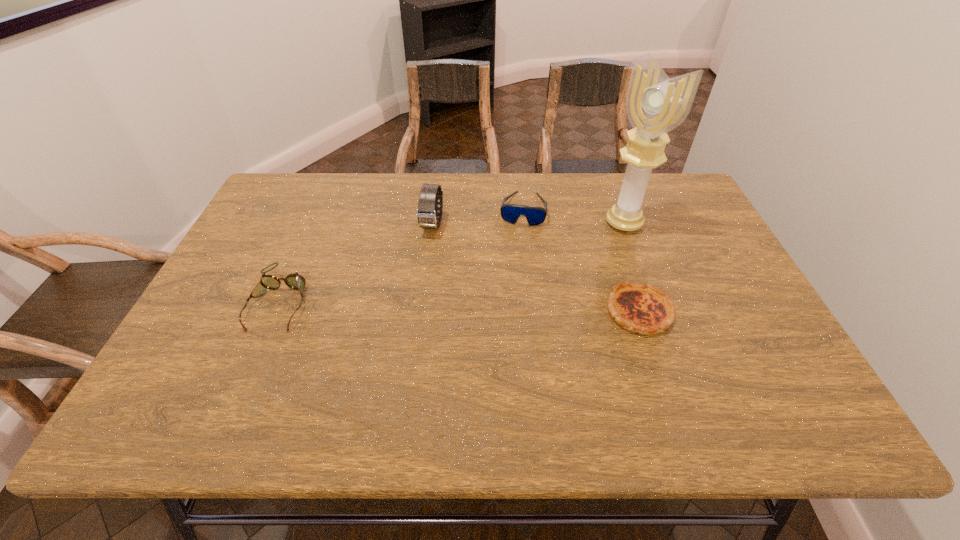
Find the location of a particular element. Image resolution: width=960 pixels, height=540 pixels. award that is at the far edge is located at coordinates (655, 104).

Locate an element on the screen. The width and height of the screenshot is (960, 540). sunglasses that is at the far edge is located at coordinates pos(535,215).

Find the location of a particular element. object that is at the left edge is located at coordinates (x=295, y=281).

The image size is (960, 540). In the image, there is a desktop. Identify the location of vacant space at the far edge. (435, 173).

You are a GUI agent. You are given a task and a screenshot of the screen. Output one action in this format:
    pyautogui.click(x=<x>, y=<y>)
    Task: Click on the free space at the near edge
    
    Given the screenshot: What is the action you would take?
    pyautogui.click(x=514, y=357)

In the image, there is a desktop. Identify the location of free space at the left edge. The image size is (960, 540). (253, 219).

This screenshot has height=540, width=960. Identify the location of free point at the right edge. (704, 249).

In the image, there is a desktop. Where is `free space at the far left corner`? free space at the far left corner is located at coordinates (282, 188).

Find the location of a particular element. This screenshot has width=960, height=540. vacant space at the near left corner of the desktop is located at coordinates (217, 382).

In the image, there is a desktop. In order to click on vacant space at the far right corner in this screenshot , I will do `click(683, 207)`.